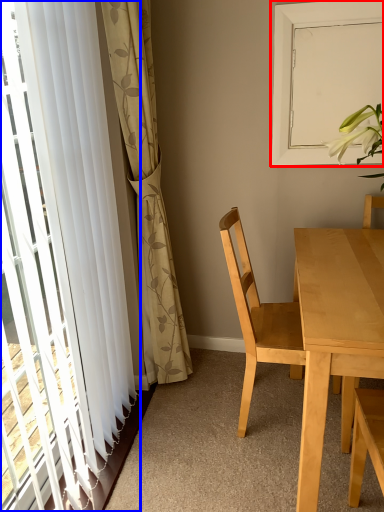
Question: Which point is closer to the camera, window screen (highlighted by a red box) or curtain (highlighted by a blue box)?

Choices:
 (A) window screen
 (B) curtain

Answer: (B)